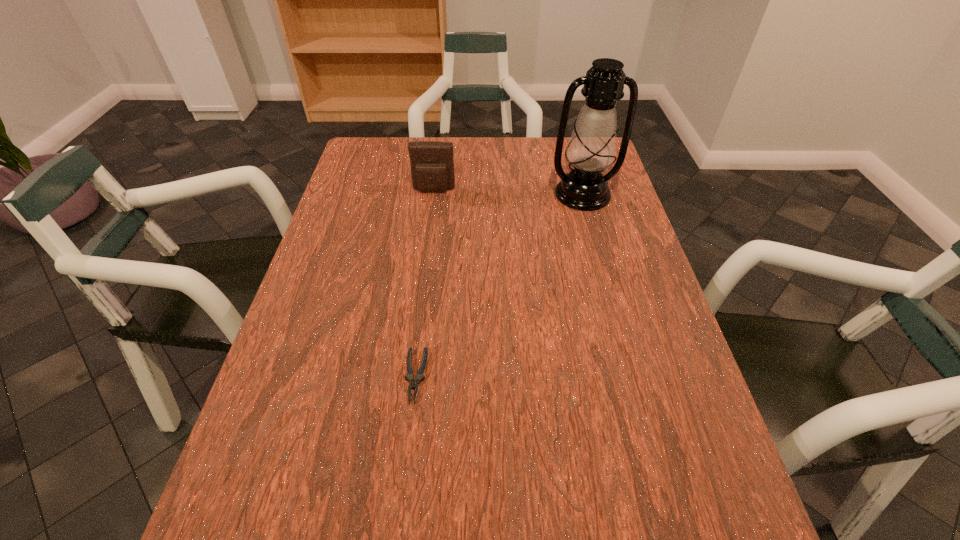
Locate an element on the screen. The width and height of the screenshot is (960, 540). the tallest object is located at coordinates (592, 147).

This screenshot has height=540, width=960. What are the coordinates of `the rightmost object` in the screenshot? It's located at (592, 147).

The image size is (960, 540). I want to click on pouch, so click(x=432, y=166).

You are a GUI agent. You are given a task and a screenshot of the screen. Output one action in this format:
    pyautogui.click(x=<x>, y=<y>)
    Task: Click on the pliers
    The width and height of the screenshot is (960, 540).
    Given the screenshot: What is the action you would take?
    pyautogui.click(x=409, y=376)

Find the location of `the nearest object`. the nearest object is located at coordinates (409, 376).

This screenshot has width=960, height=540. I want to click on vacant point located 0.320m on the left of the rightmost object, so click(x=441, y=194).

Where is `vacant space situated 0.100m with an open flap on the second tallest object`? This screenshot has width=960, height=540. vacant space situated 0.100m with an open flap on the second tallest object is located at coordinates (431, 217).

Where is `vacant region located at the gripping part of the pliers`? The height and width of the screenshot is (540, 960). vacant region located at the gripping part of the pliers is located at coordinates (405, 464).

At what (x,y) coordinates should I click in order to perform the action: click on object positioned at the right edge. Please return your answer as a coordinate pair (x, y). Looking at the image, I should click on (592, 147).

The width and height of the screenshot is (960, 540). Find the location of `vacant space at the far edge of the desktop`. vacant space at the far edge of the desktop is located at coordinates (408, 171).